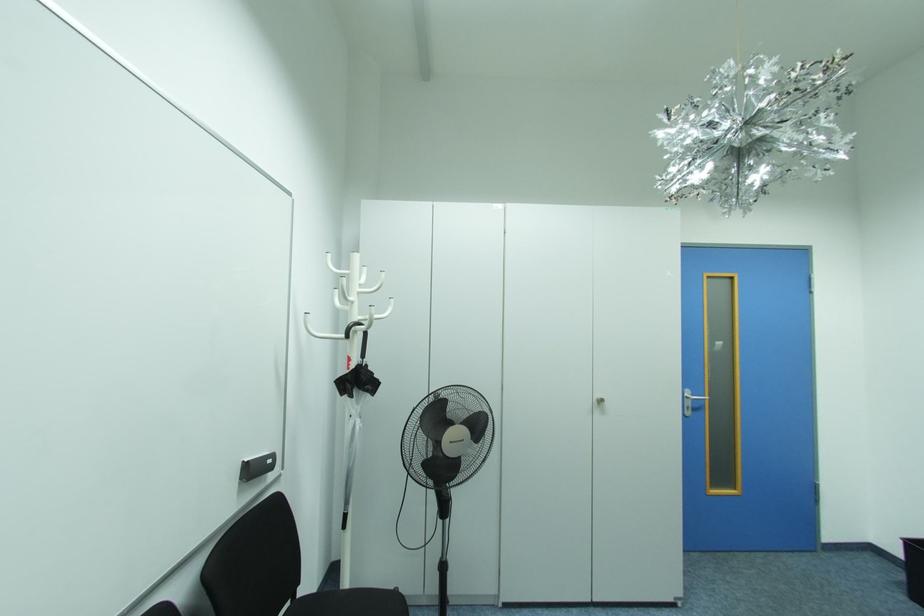
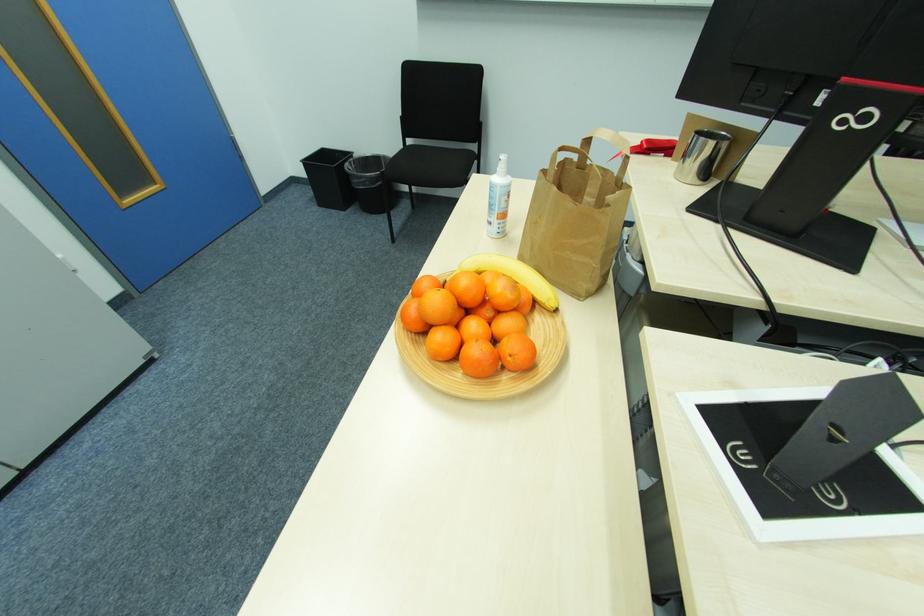
How did the camera likely rotate?

The rotation direction of the camera is right-down.